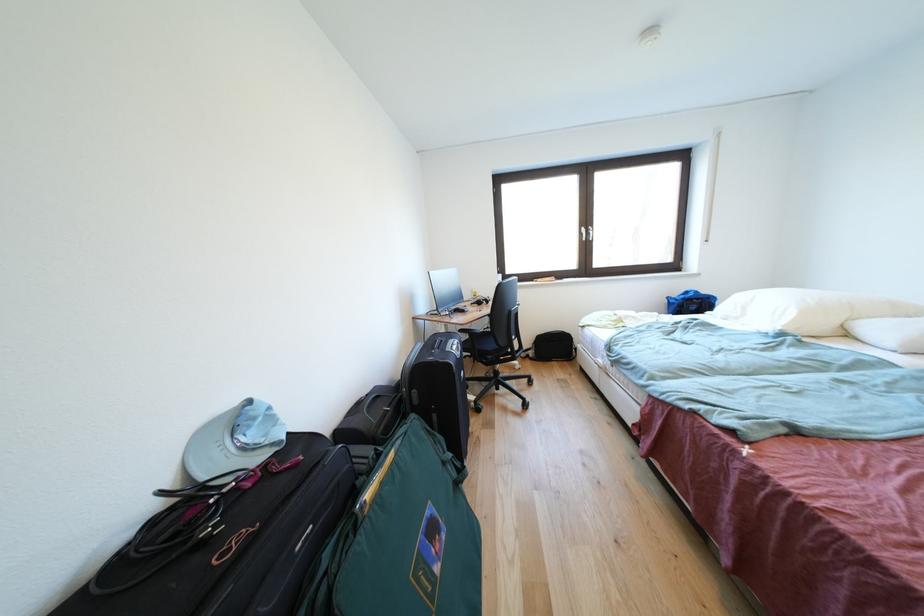
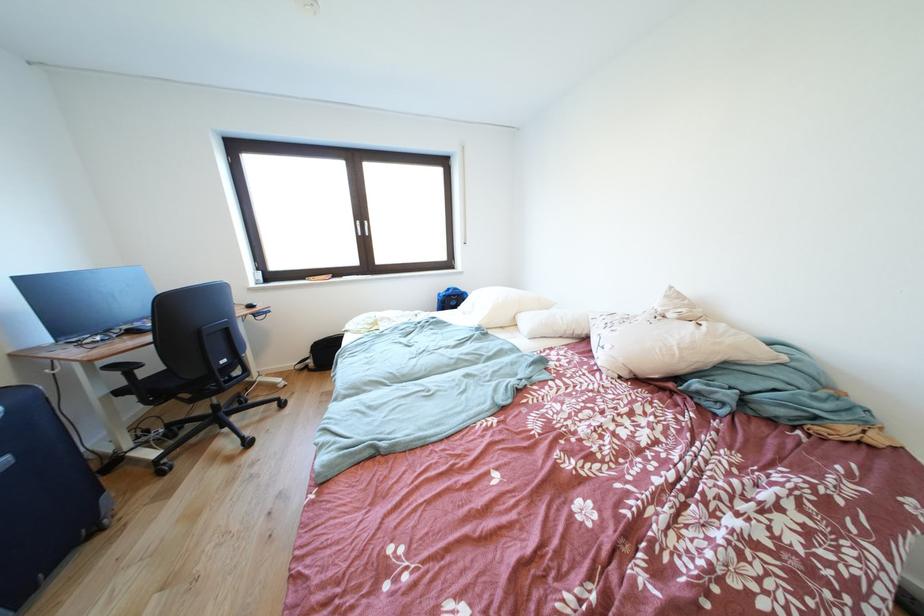
Find the pixel in the second image that matches point 591,233 in the first image.

(367, 228)